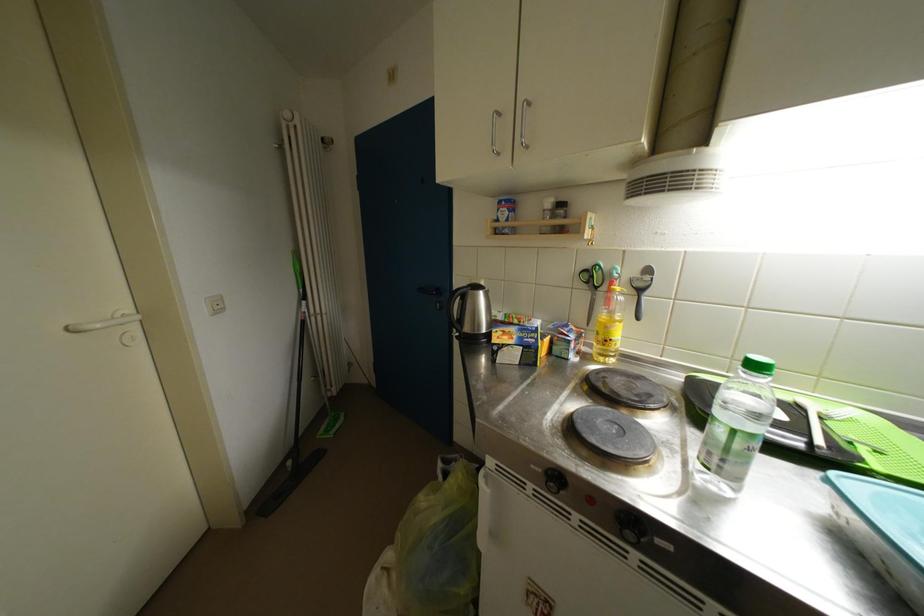
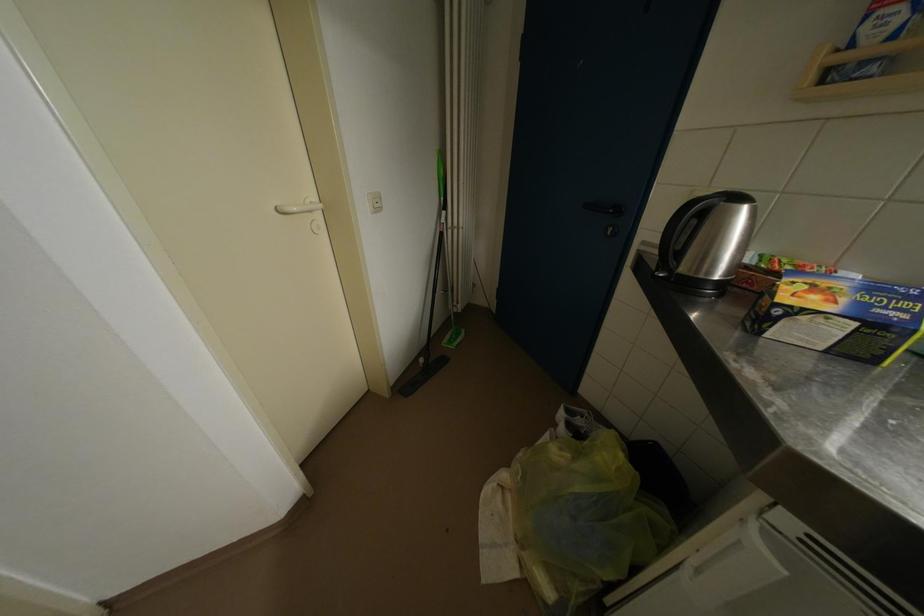
In the second image, find the point that corresponds to pixel 395 557 in the first image.

(511, 480)